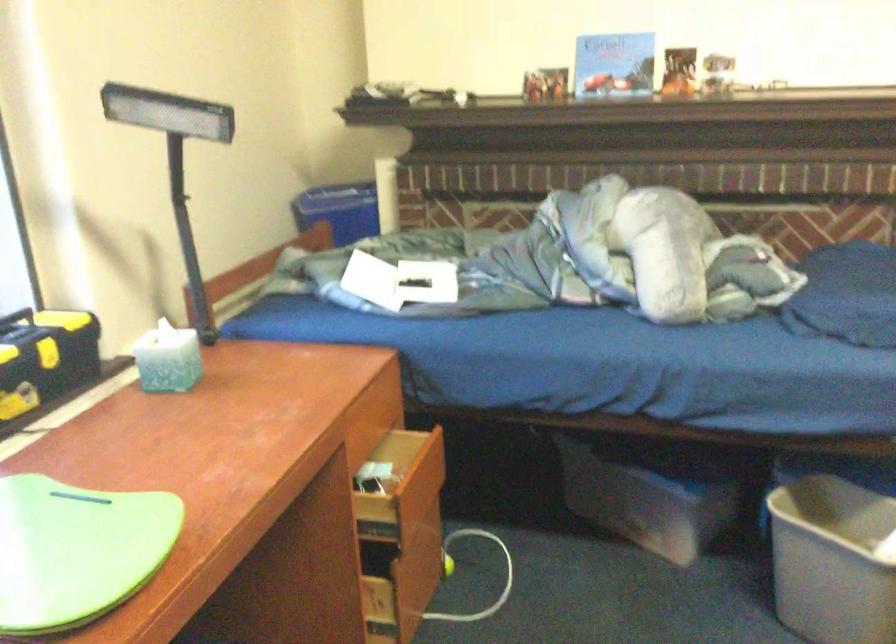
Where would you rotat the black lamp head? Please return your answer as a coordinate pair (x, y).

(176, 162)